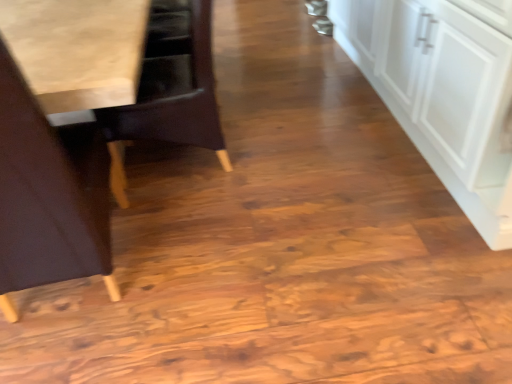
Question: Does white matte cabinet at right have a greater width compared to light brown wood chair at left, arranged as the first chair when viewed from the front?

Choices:
 (A) no
 (B) yes

Answer: (B)

Question: From a real-world perspective, is white matte cabinet at right located higher than light brown wood chair at left, which is counted as the second chair, starting from the back?

Choices:
 (A) no
 (B) yes

Answer: (A)

Question: Is the position of white matte cabinet at right more distant than that of light brown wood chair at left, arranged as the first chair when viewed from the front?

Choices:
 (A) no
 (B) yes

Answer: (B)

Question: Could you tell me if white matte cabinet at right is facing light brown wood chair at left, which is counted as the second chair, starting from the back?

Choices:
 (A) yes
 (B) no

Answer: (A)

Question: From the image's perspective, is white matte cabinet at right below light brown wood chair at left, which is counted as the second chair, starting from the back?

Choices:
 (A) no
 (B) yes

Answer: (A)

Question: Is point (129, 114) positioned closer to the camera than point (108, 284)?

Choices:
 (A) closer
 (B) farther

Answer: (B)

Question: Considering the positions of wooden chair at left, positioned as the first chair in back-to-front order, and light brown wood chair at left, arranged as the first chair when viewed from the front, in the image, is wooden chair at left, positioned as the first chair in back-to-front order, taller or shorter than light brown wood chair at left, arranged as the first chair when viewed from the front,?

Choices:
 (A) tall
 (B) short

Answer: (B)

Question: Would you say wooden chair at left, positioned as the first chair in back-to-front order, is inside or outside light brown wood chair at left, which is counted as the second chair, starting from the back?

Choices:
 (A) outside
 (B) inside

Answer: (A)

Question: From the image's perspective, is wooden chair at left, positioned as the first chair in back-to-front order, positioned above or below light brown wood chair at left, which is counted as the second chair, starting from the back?

Choices:
 (A) above
 (B) below

Answer: (A)

Question: Is white matte cabinet at right in front of or behind light brown wood chair at left, arranged as the first chair when viewed from the front, in the image?

Choices:
 (A) front
 (B) behind

Answer: (B)

Question: Considering the positions of point (500, 152) and point (46, 261), is point (500, 152) closer or farther from the camera than point (46, 261)?

Choices:
 (A) farther
 (B) closer

Answer: (A)

Question: From the image's perspective, is white matte cabinet at right positioned above or below light brown wood chair at left, which is counted as the second chair, starting from the back?

Choices:
 (A) above
 (B) below

Answer: (A)

Question: Would you say white matte cabinet at right is to the left or to the right of light brown wood chair at left, which is counted as the second chair, starting from the back, in the picture?

Choices:
 (A) right
 (B) left

Answer: (A)

Question: From a real-world perspective, is wooden chair at left, which is the 2th chair from front to back, physically located above or below white matte cabinet at right?

Choices:
 (A) below
 (B) above

Answer: (B)

Question: Is wooden chair at left, positioned as the first chair in back-to-front order, to the left or to the right of white matte cabinet at right in the image?

Choices:
 (A) right
 (B) left

Answer: (B)